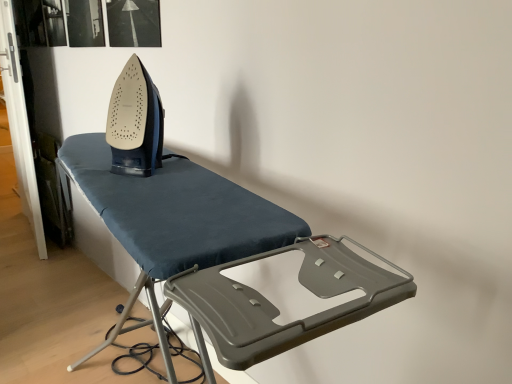
Question: From their relative heights in the image, would you say dark blue fabric ironing board at center is taller or shorter than matte black iron at center?

Choices:
 (A) tall
 (B) short

Answer: (A)

Question: Does point (154, 322) appear closer or farther from the camera than point (151, 152)?

Choices:
 (A) farther
 (B) closer

Answer: (B)

Question: From the image's perspective, is dark blue fabric ironing board at center positioned above or below matte black iron at center?

Choices:
 (A) below
 (B) above

Answer: (A)

Question: Based on their sizes in the image, would you say matte black iron at center is bigger or smaller than dark blue fabric ironing board at center?

Choices:
 (A) big
 (B) small

Answer: (B)

Question: From the image's perspective, relative to dark blue fabric ironing board at center, is matte black iron at center above or below?

Choices:
 (A) below
 (B) above

Answer: (B)

Question: Does point (112, 99) appear closer or farther from the camera than point (254, 243)?

Choices:
 (A) closer
 (B) farther

Answer: (B)

Question: From their relative heights in the image, would you say matte black iron at center is taller or shorter than dark blue fabric ironing board at center?

Choices:
 (A) short
 (B) tall

Answer: (A)